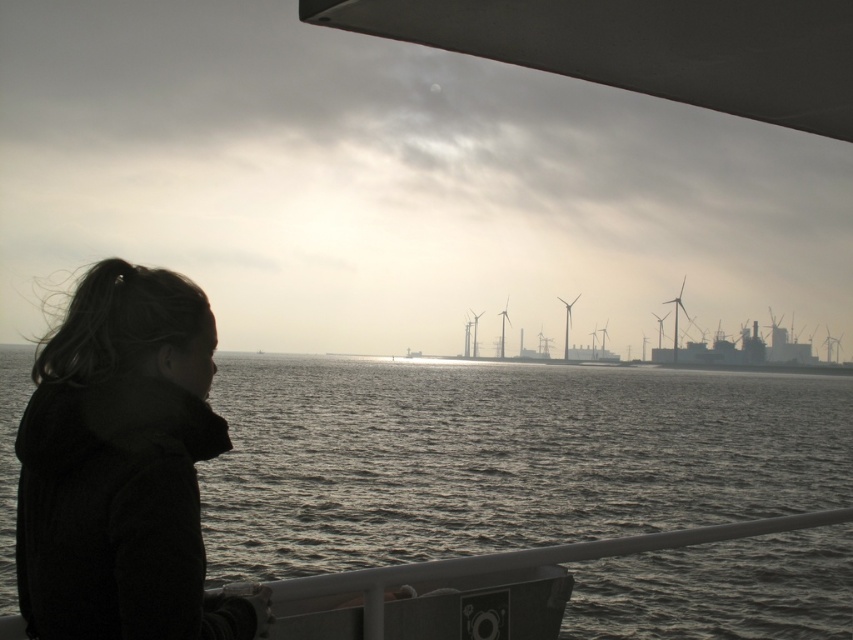
Who is lower down, gray matte water at lower center or dark woolen jacket at left?

gray matte water at lower center

Image resolution: width=853 pixels, height=640 pixels. Find the location of `gray matte water at lower center`. gray matte water at lower center is located at coordinates (502, 456).